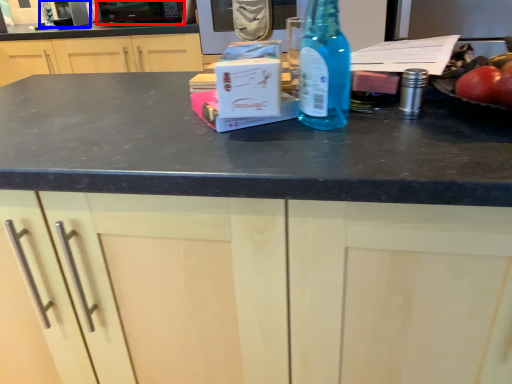
Question: Which object appears farthest to the camera in this image, appliance (highlighted by a red box) or appliance (highlighted by a blue box)?

Choices:
 (A) appliance
 (B) appliance

Answer: (B)